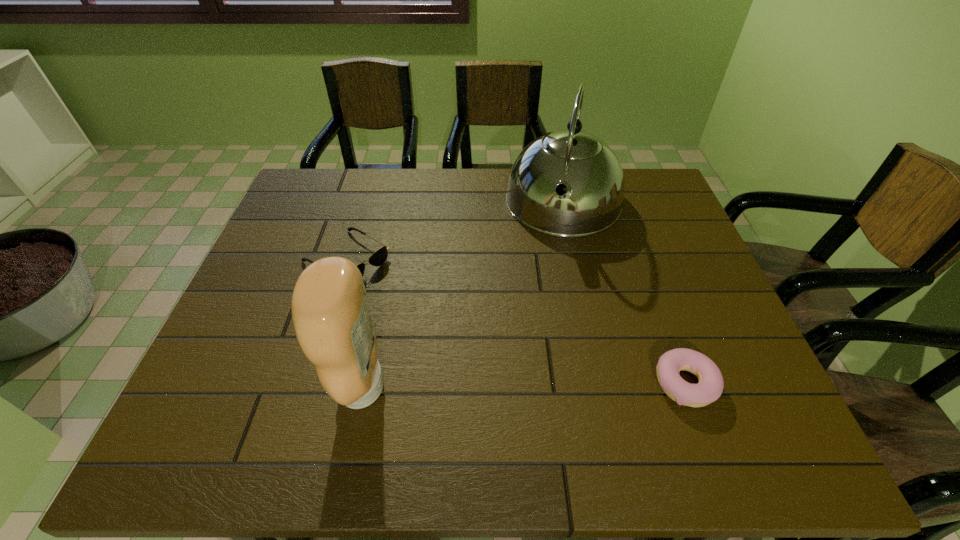
The image size is (960, 540). Find the location of `condiment`. condiment is located at coordinates (330, 313).

Locate an element on the screen. This screenshot has width=960, height=540. doughnut is located at coordinates (709, 389).

Where is `sunglasses`? This screenshot has width=960, height=540. sunglasses is located at coordinates (379, 257).

Where is `kettle`? kettle is located at coordinates (578, 165).

You are a GUI agent. You are given a task and a screenshot of the screen. Output one action in this format:
    pyautogui.click(x=<x>, y=<y>)
    Task: Click on the vacant area situated 0.110m on the label of the condiment
    Image resolution: width=960 pixels, height=540 pixels.
    Given the screenshot: What is the action you would take?
    pyautogui.click(x=284, y=387)

Image resolution: width=960 pixels, height=540 pixels. In order to click on free location located 0.240m on the label of the condiment in this screenshot , I will do `click(223, 387)`.

Find the location of a particular element. vacant space located 0.140m on the left of the doughnut is located at coordinates (588, 383).

At what (x,y) coordinates should I click in order to perform the action: click on vacant region located 0.290m on the front-facing side of the sunglasses. Please return your answer as a coordinate pair (x, y). Image resolution: width=960 pixels, height=540 pixels. Looking at the image, I should click on (463, 332).

What are the coordinates of `vacant point located on the front-facing side of the sunglasses` in the screenshot? It's located at (407, 297).

Image resolution: width=960 pixels, height=540 pixels. I want to click on free region located 0.080m on the front-facing side of the sunglasses, so click(x=399, y=292).